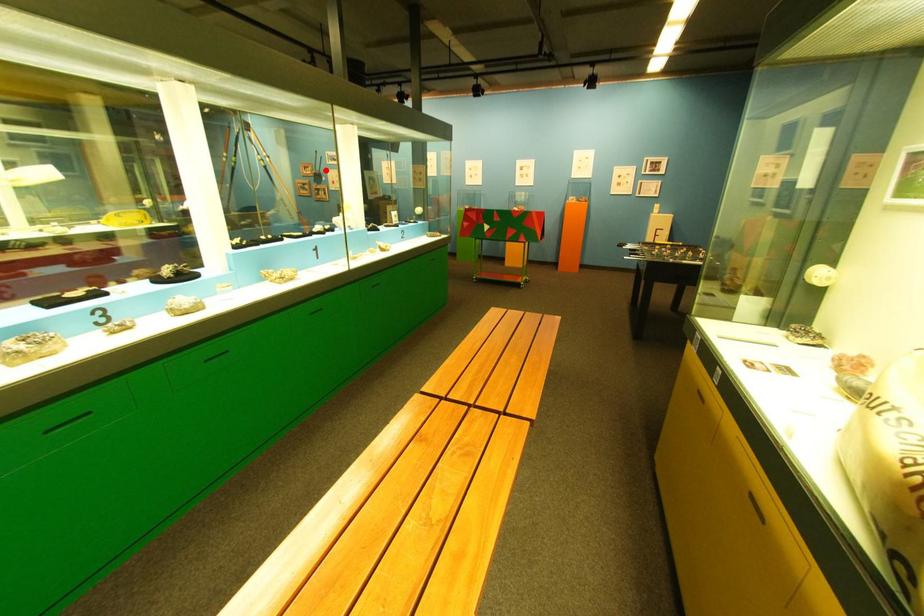
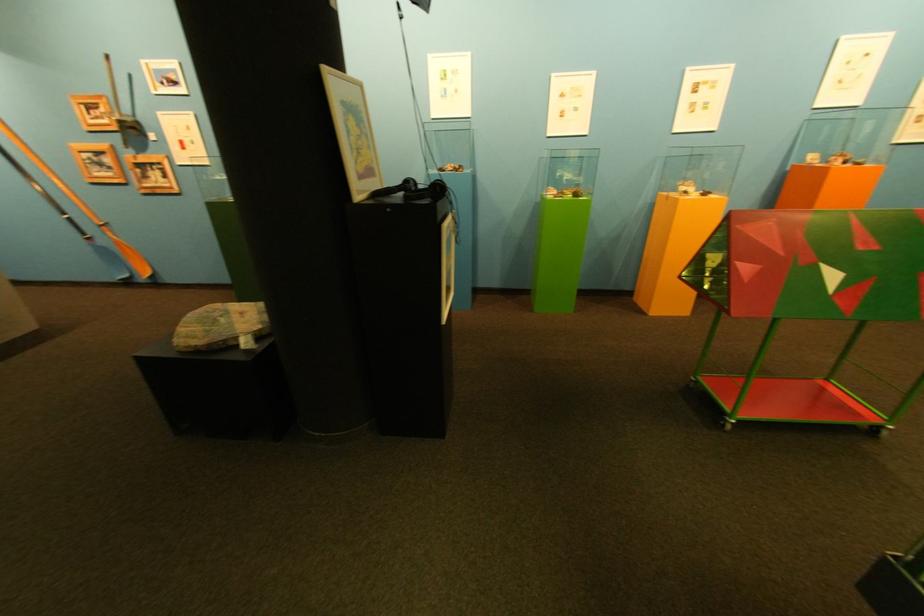
Find the pixel in the second image that matches the highlighted location in the first image.

(118, 111)